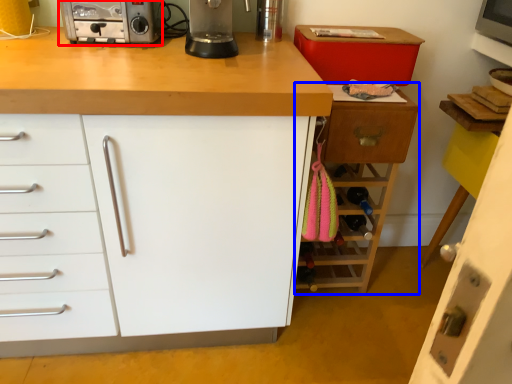
Question: Which object is further to the camera taking this photo, home appliance (highlighted by a red box) or cabinetry (highlighted by a blue box)?

Choices:
 (A) home appliance
 (B) cabinetry

Answer: (B)